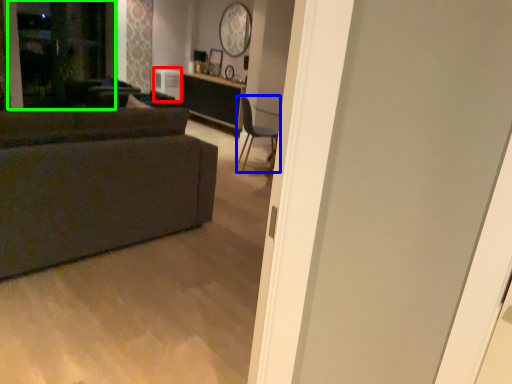
Question: Which object is positioned farthest from appliance (highlighted by a red box)? Select from chair (highlighted by a blue box) and screen door (highlighted by a green box).

Choices:
 (A) chair
 (B) screen door

Answer: (A)